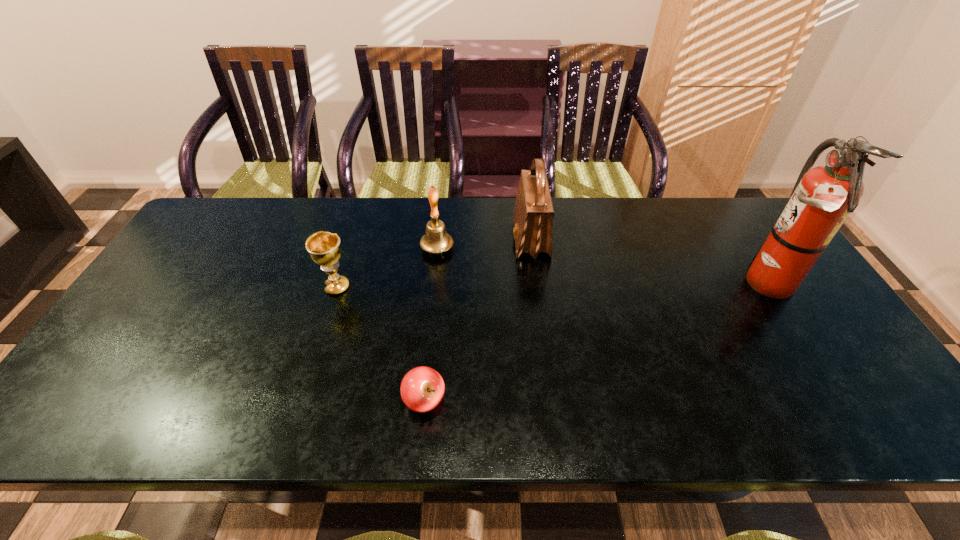
At what (x,y) coordinates should I click in order to perform the action: click on the tallest object. Please return your answer as a coordinate pair (x, y). This screenshot has width=960, height=540. Looking at the image, I should click on (822, 198).

This screenshot has width=960, height=540. Find the location of `the rightmost object`. the rightmost object is located at coordinates (822, 198).

You are a GUI agent. You are given a task and a screenshot of the screen. Output one action in this format:
    pyautogui.click(x=<x>, y=<y>)
    Task: Click on the shoulder bag
    
    Given the screenshot: What is the action you would take?
    pyautogui.click(x=533, y=216)

Identify the location of the second object from right to left. (533, 216).

The width and height of the screenshot is (960, 540). What are the coordinates of `the third tallest object` in the screenshot? It's located at (436, 240).

Locate an element on the screen. This screenshot has height=540, width=960. the fourth tallest object is located at coordinates (324, 248).

You are a GUI agent. You are given a task and a screenshot of the screen. Output one action in this format:
    pyautogui.click(x=<x>, y=<y>)
    Task: Click on the chalice
    
    Given the screenshot: What is the action you would take?
    324,248

You are a GUI agent. You are given a task and a screenshot of the screen. Output one action in this format:
    pyautogui.click(x=<x>, y=<y>)
    Task: Click on the shortest object
    The width and height of the screenshot is (960, 540).
    Given the screenshot: What is the action you would take?
    pyautogui.click(x=422, y=388)

The width and height of the screenshot is (960, 540). I want to click on the nearest object, so click(422, 388).

Where is `vacant space situated from the nozzle of the tallest object`? Image resolution: width=960 pixels, height=540 pixels. vacant space situated from the nozzle of the tallest object is located at coordinates (701, 282).